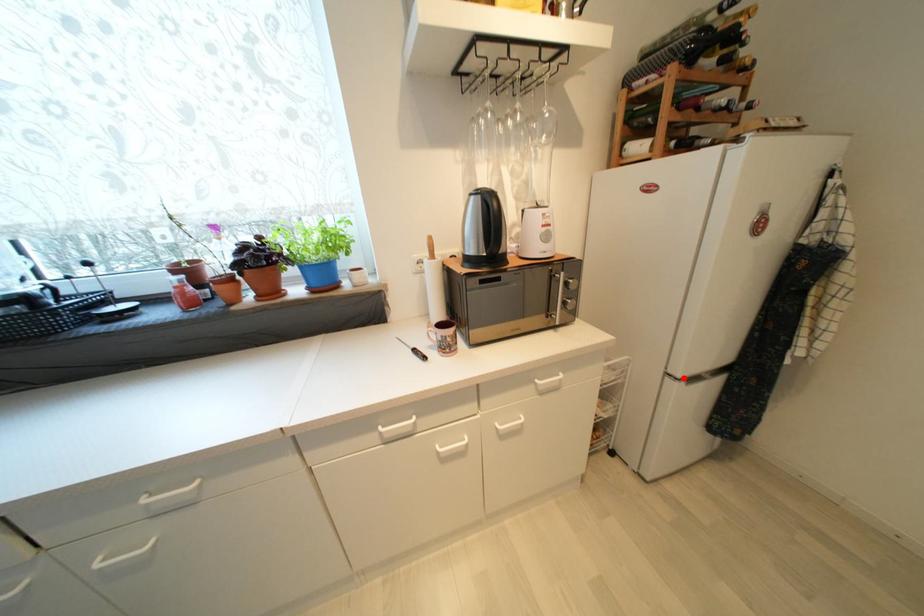
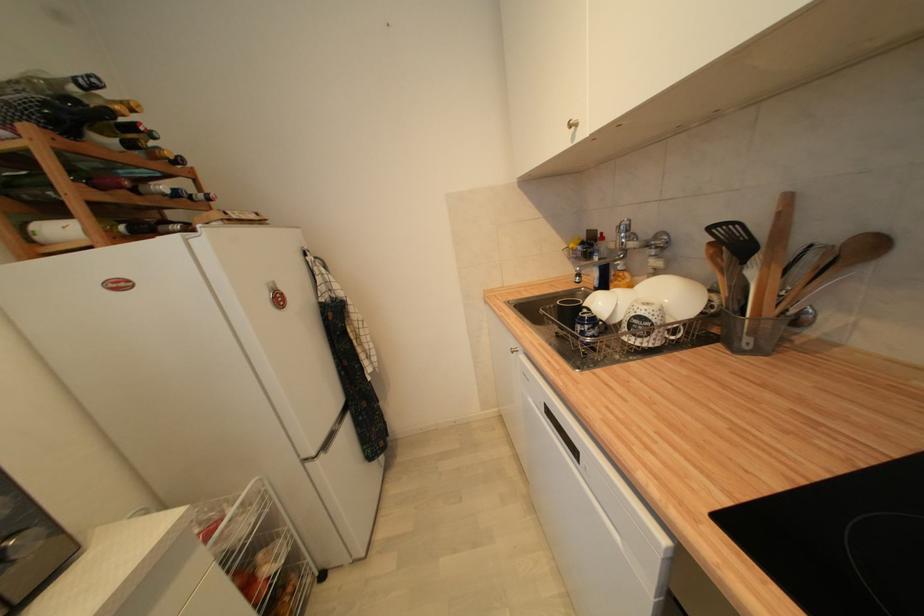
Question: I am providing you with two images of the same scene from different viewpoints. A red point is shown in image1. For the corresponding object point in image2, is it positioned nearer or farther from the camera?

Choices:
 (A) Nearer
 (B) Farther

Answer: (A)